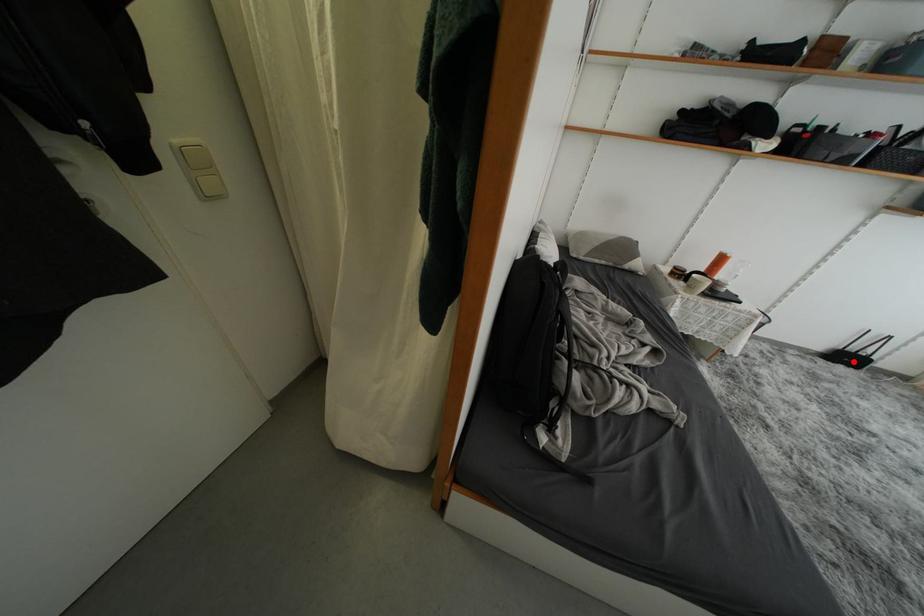
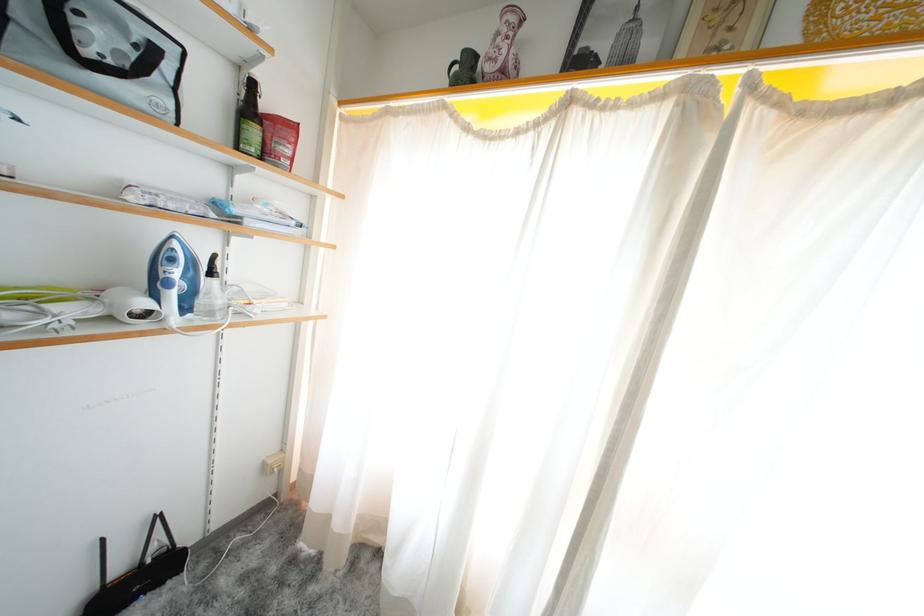
Question: I am providing you with two images of the same scene from different viewpoints. In image1, a red point is highlighted. Considering the same 3D point in image2, which of the following is correct?

Choices:
 (A) It is closer
 (B) It is farther

Answer: (A)